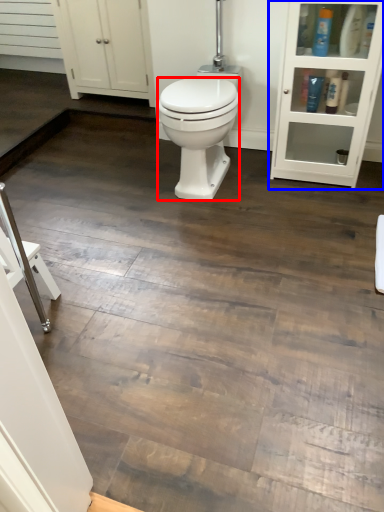
Question: Which object appears closest to the camera in this image, bidet (highlighted by a red box) or shelf (highlighted by a blue box)?

Choices:
 (A) bidet
 (B) shelf

Answer: (B)